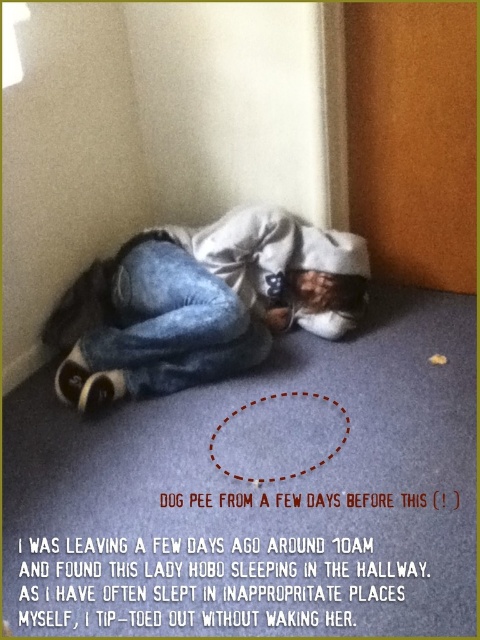
Question: Which point is farther from the camera taking this photo?

Choices:
 (A) (130, 330)
 (B) (265, 292)

Answer: (B)

Question: Among these points, which one is farthest from the camera?

Choices:
 (A) (224, 339)
 (B) (119, 348)

Answer: (B)

Question: Is faded denim jacket at lower right bigger than denim at lower left?

Choices:
 (A) yes
 (B) no

Answer: (A)

Question: Is faded denim jacket at lower right thinner than denim at lower left?

Choices:
 (A) yes
 (B) no

Answer: (B)

Question: Among these objects, which one is farthest from the camera?

Choices:
 (A) denim at lower left
 (B) faded denim jacket at lower right

Answer: (B)

Question: Does faded denim jacket at lower right have a smaller size compared to denim at lower left?

Choices:
 (A) yes
 (B) no

Answer: (B)